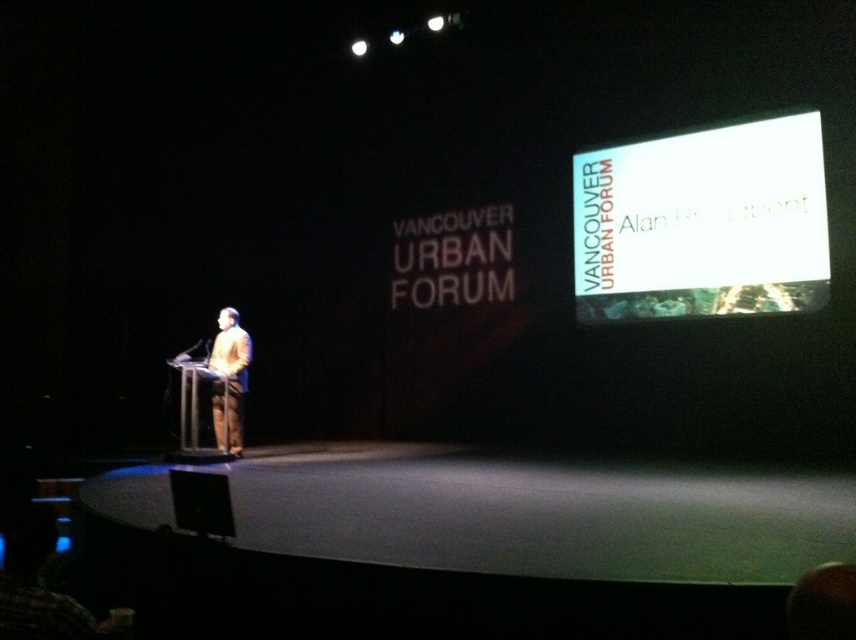
Can you confirm if white glossy projection screen at upper right is positioned above matte brown suit at center?

Yes, white glossy projection screen at upper right is above matte brown suit at center.

Where is `white glossy projection screen at upper right`? The height and width of the screenshot is (640, 856). white glossy projection screen at upper right is located at coordinates (703, 224).